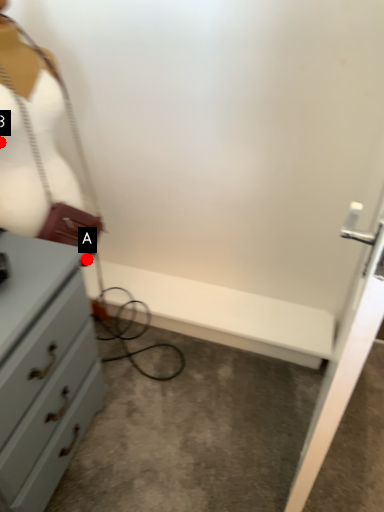
Question: Two points are circled on the image, labeled by A and B beside each circle. Which point is closer to the camera taking this photo?

Choices:
 (A) A is closer
 (B) B is closer

Answer: (B)